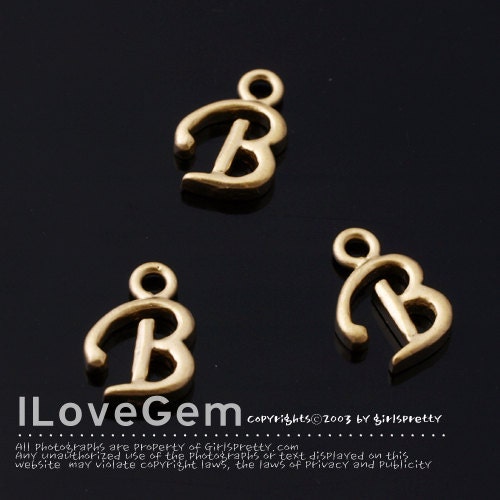
Find the location of a particular element. Image resolution: width=500 pixels, height=500 pixels. "b" pendants in the front is located at coordinates coord(171,343), coord(394,308).